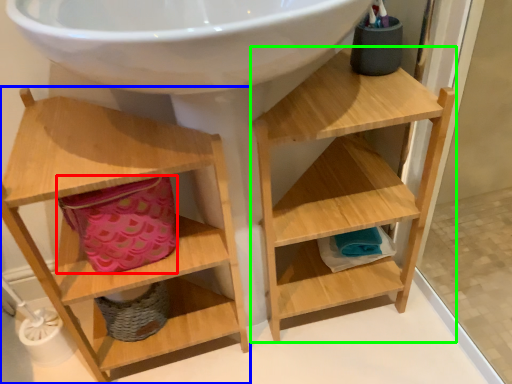
Question: Based on their relative distances, which object is farther from basket (highlighted by a red box)? Choose from shelf (highlighted by a blue box) and shelf (highlighted by a green box).

Choices:
 (A) shelf
 (B) shelf

Answer: (B)